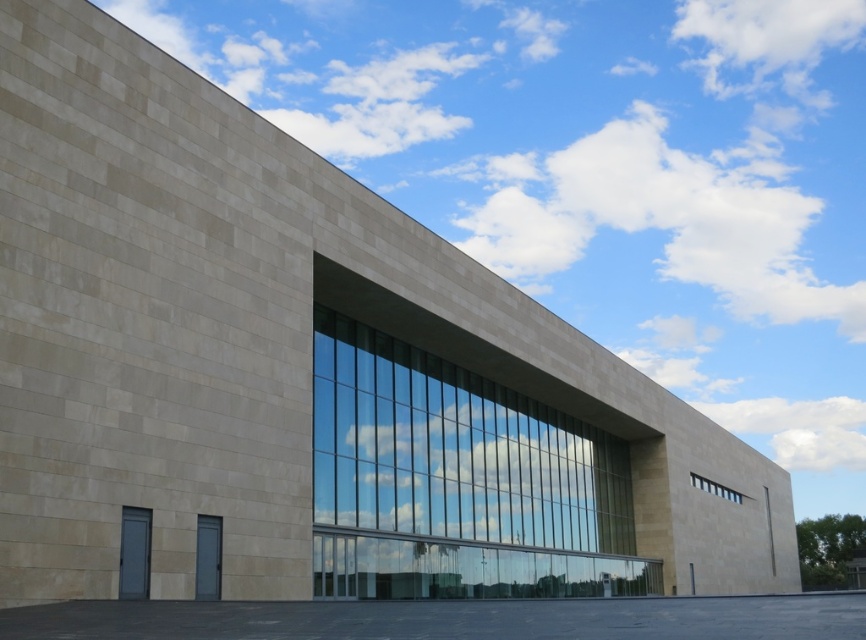
What are the coordinates of the transparent glass window at center?

The transparent glass window at center is located at coordinates point (x=457, y=481).

You are standing in front of the modern architectural structure and want to determine the relative positions of two points on its facade. Which of the two points, point 1 at coordinates [388,518] or point 2 at [705,481], is closer to your viewpoint?

Point 1 at coordinates [388,518] is closer to the camera than point 2 at [705,481].

You are a window installer working on a modern building. You need to place a new window that is 2 meters wide between the transparent glass window at center and the clear glass window at upper center. Is there enough space between them to fit the new window?

The transparent glass window at center and clear glass window at upper center are 20.58 meters apart from each other, so yes, there is enough space between them to fit a new window that is 2 meters wide.